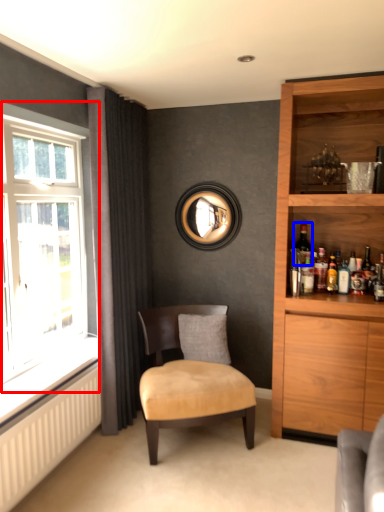
Question: Among these objects, which one is nearest to the camera, window (highlighted by a red box) or wine bottle (highlighted by a blue box)?

Choices:
 (A) window
 (B) wine bottle

Answer: (A)